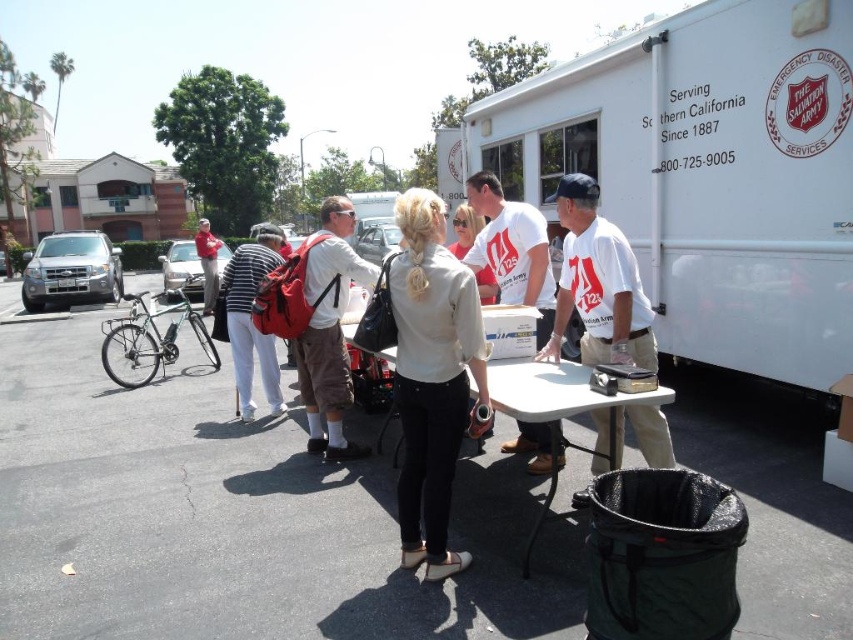
You are standing at the edge of the parking lot and see the white matte truck at center and the white plastic picnic table at center. Which object is positioned higher in the image?

The white matte truck at center is positioned higher than the white plastic picnic table at center in the image.